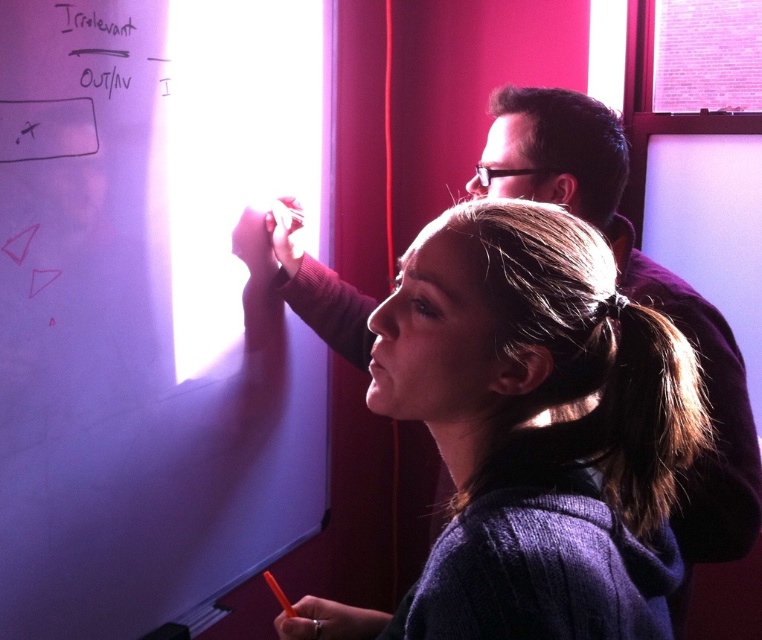
Between point (136, 259) and point (442, 256), which one is positioned behind?

Positioned behind is point (136, 259).

The height and width of the screenshot is (640, 762). Find the location of `white matte board at upper left`. white matte board at upper left is located at coordinates (152, 305).

Identify the location of white matte board at upper left. The image size is (762, 640). (152, 305).

This screenshot has height=640, width=762. I want to click on white matte board at upper left, so click(x=152, y=305).

This screenshot has width=762, height=640. I want to click on white matte board at upper left, so click(x=152, y=305).

Can you confirm if white matte board at upper left is taller than white paper at upper left?

Yes.

The width and height of the screenshot is (762, 640). What do you see at coordinates (152, 305) in the screenshot?
I see `white matte board at upper left` at bounding box center [152, 305].

You are a GUI agent. You are given a task and a screenshot of the screen. Output one action in this format:
    pyautogui.click(x=<x>, y=<y>)
    Task: Click on the white matte board at upper left
    The height and width of the screenshot is (640, 762).
    Given the screenshot: What is the action you would take?
    pyautogui.click(x=152, y=305)

From the picture: How distant is purple sweater at center from white paper at upper left?

A distance of 34.15 inches exists between purple sweater at center and white paper at upper left.

Does purple sweater at center have a lesser width compared to white paper at upper left?

No.

This screenshot has height=640, width=762. In order to click on purple sweater at center in this screenshot , I will do `click(536, 364)`.

This screenshot has height=640, width=762. Identify the location of purple sweater at center. (536, 364).